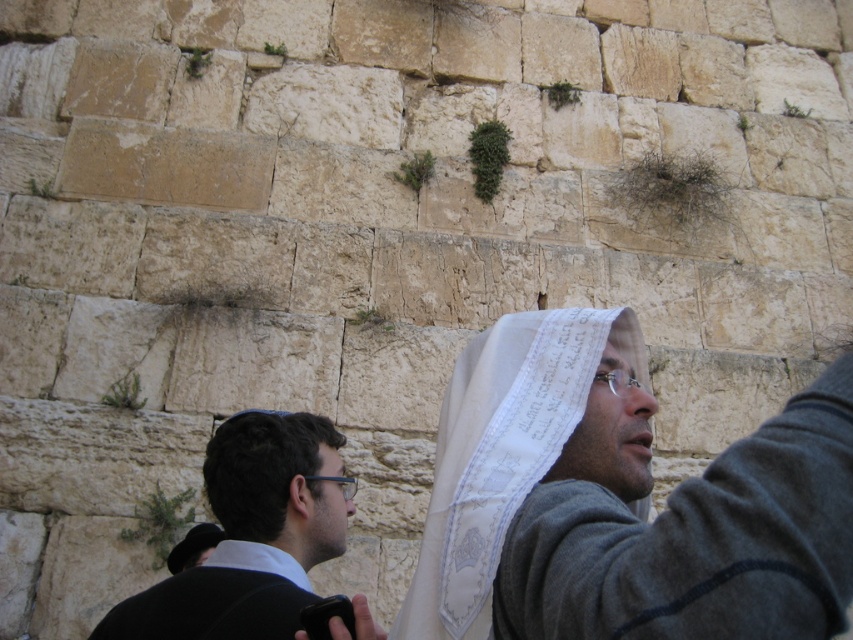
You are standing at the Western Wall and want to place a prayer note between the two points marked at coordinates point (474, 452) and point (326, 458). Which point should you place the note closer to in order to ensure it is more visible to people standing in front of the wall?

You should place the note closer to point (474, 452) because it is closer to the camera, making it more visible to people standing in front of the wall.

You are a tourist visiting the Western Wall and notice two items in the scene. One is a white sheer cloth at center and the other is dark brown hair at lower left. Which item is wider?

The white sheer cloth at center might be wider than dark brown hair at lower left.

You are standing at the Western Wall and see a point marked at coordinates [697,541]. What object is this point located on?

The point at [697,541] is located on the white paper at center.